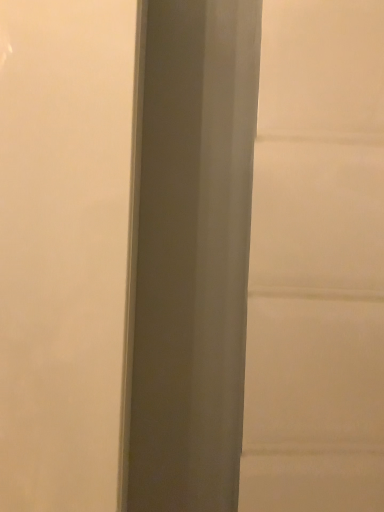
Describe the element at coordinates (63, 248) in the screenshot. I see `white matte screen door at center` at that location.

Find the location of `white matte screen door at center`. white matte screen door at center is located at coordinates (63, 248).

The image size is (384, 512). I want to click on white matte screen door at center, so [63, 248].